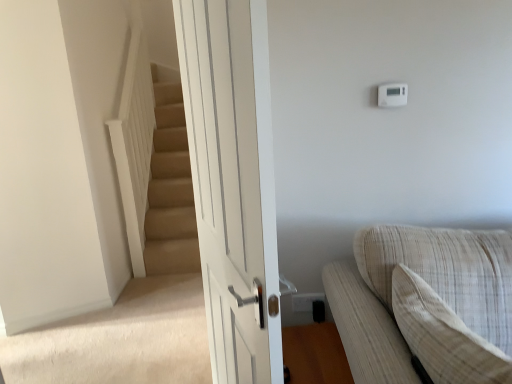
Question: Would you say light beige textured pillow at right is a long distance from white plastic electric outlet at lower right?

Choices:
 (A) no
 (B) yes

Answer: (A)

Question: Is light beige textured pillow at right looking in the opposite direction of white plastic electric outlet at lower right?

Choices:
 (A) no
 (B) yes

Answer: (A)

Question: Can you confirm if light beige textured pillow at right is smaller than white plastic electric outlet at lower right?

Choices:
 (A) no
 (B) yes

Answer: (A)

Question: From the image's perspective, does light beige textured pillow at right appear higher than white plastic electric outlet at lower right?

Choices:
 (A) no
 (B) yes

Answer: (B)

Question: Is light beige textured pillow at right bigger than white plastic electric outlet at lower right?

Choices:
 (A) no
 (B) yes

Answer: (B)

Question: Considering the positions of light beige textured pillow at right and beige textured couch at lower right in the image, is light beige textured pillow at right taller or shorter than beige textured couch at lower right?

Choices:
 (A) short
 (B) tall

Answer: (A)

Question: Is light beige textured pillow at right in front of or behind beige textured couch at lower right in the image?

Choices:
 (A) behind
 (B) front

Answer: (A)

Question: Considering the positions of light beige textured pillow at right and beige textured couch at lower right in the image, is light beige textured pillow at right wider or thinner than beige textured couch at lower right?

Choices:
 (A) thin
 (B) wide

Answer: (A)

Question: Considering the positions of point (423, 309) and point (436, 261), is point (423, 309) closer or farther from the camera than point (436, 261)?

Choices:
 (A) farther
 (B) closer

Answer: (B)

Question: Is beige textured couch at lower right in front of or behind white plastic electric outlet at lower right in the image?

Choices:
 (A) front
 (B) behind

Answer: (A)

Question: From a real-world perspective, relative to white plastic electric outlet at lower right, is beige textured couch at lower right vertically above or below?

Choices:
 (A) above
 (B) below

Answer: (A)

Question: Choose the correct answer: Is beige textured couch at lower right inside white plastic electric outlet at lower right or outside it?

Choices:
 (A) outside
 (B) inside

Answer: (A)

Question: Considering the positions of beige textured couch at lower right and white plastic electric outlet at lower right in the image, is beige textured couch at lower right taller or shorter than white plastic electric outlet at lower right?

Choices:
 (A) short
 (B) tall

Answer: (B)

Question: From a real-world perspective, relative to light beige textured pillow at right, is beige textured couch at lower right vertically above or below?

Choices:
 (A) above
 (B) below

Answer: (B)

Question: Which is correct: beige textured couch at lower right is inside light beige textured pillow at right, or outside of it?

Choices:
 (A) outside
 (B) inside

Answer: (A)